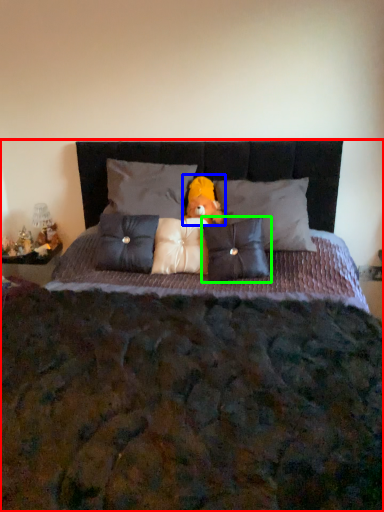
Question: Which object is positioned farthest from bed (highlighted by a red box)? Select from doll (highlighted by a blue box) and pillow (highlighted by a green box).

Choices:
 (A) doll
 (B) pillow

Answer: (A)